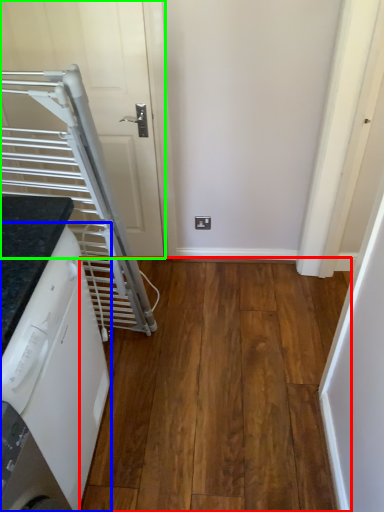
Question: Which is farther away from hardwood (highlighted by a red box)? home appliance (highlighted by a blue box) or door (highlighted by a green box)?

Choices:
 (A) home appliance
 (B) door

Answer: (B)